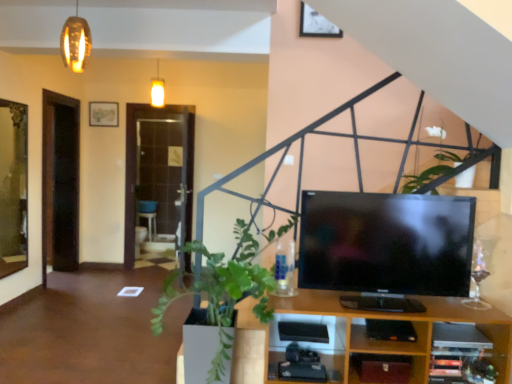
Question: Can you confirm if metallic silver picture frame at upper center is wider than green leafy plant at lower left?

Choices:
 (A) no
 (B) yes

Answer: (A)

Question: Can you confirm if metallic silver picture frame at upper center is thinner than green leafy plant at lower left?

Choices:
 (A) no
 (B) yes

Answer: (B)

Question: Is metallic silver picture frame at upper center closer to the viewer compared to green leafy plant at lower left?

Choices:
 (A) no
 (B) yes

Answer: (A)

Question: From the image's perspective, does metallic silver picture frame at upper center appear lower than green leafy plant at lower left?

Choices:
 (A) yes
 (B) no

Answer: (B)

Question: Is metallic silver picture frame at upper center placed right next to green leafy plant at lower left?

Choices:
 (A) yes
 (B) no

Answer: (B)

Question: Is metallic silver picture frame at upper center oriented towards green leafy plant at lower left?

Choices:
 (A) no
 (B) yes

Answer: (A)

Question: Does white glossy flower at upper center turn towards metallic silver picture frame at upper center?

Choices:
 (A) yes
 (B) no

Answer: (B)

Question: Are white glossy flower at upper center and metallic silver picture frame at upper center located far from each other?

Choices:
 (A) no
 (B) yes

Answer: (B)

Question: Is white glossy flower at upper center smaller than metallic silver picture frame at upper center?

Choices:
 (A) no
 (B) yes

Answer: (A)

Question: From a real-world perspective, does white glossy flower at upper center stand above metallic silver picture frame at upper center?

Choices:
 (A) yes
 (B) no

Answer: (B)

Question: From a real-world perspective, is white glossy flower at upper center positioned under metallic silver picture frame at upper center based on gravity?

Choices:
 (A) no
 (B) yes

Answer: (B)

Question: From the image's perspective, is white glossy flower at upper center located beneath metallic silver picture frame at upper center?

Choices:
 (A) yes
 (B) no

Answer: (A)

Question: Is green leafy plant at lower left shorter than white glossy flower at upper center?

Choices:
 (A) yes
 (B) no

Answer: (B)